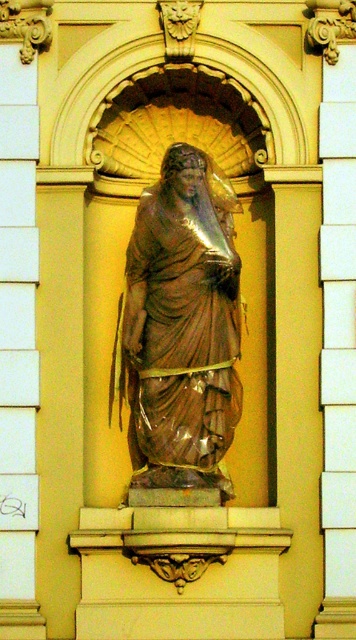
You are standing in front of the statue and want to touch the exact point at coordinates point (180,326). Is this point located on the bronze statue at center?

Yes, the point (180,326) is on the bronze statue at center according to the description.